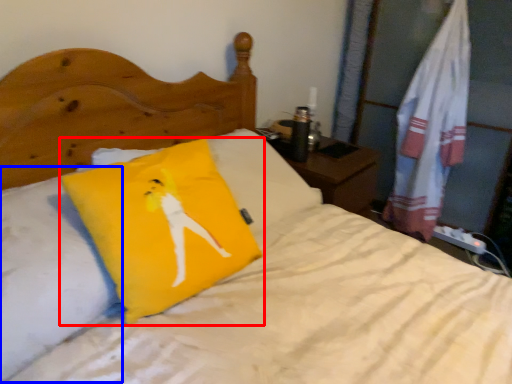
Question: Which object is closer to the camera taking this photo, pillow (highlighted by a red box) or pillow (highlighted by a blue box)?

Choices:
 (A) pillow
 (B) pillow

Answer: (B)